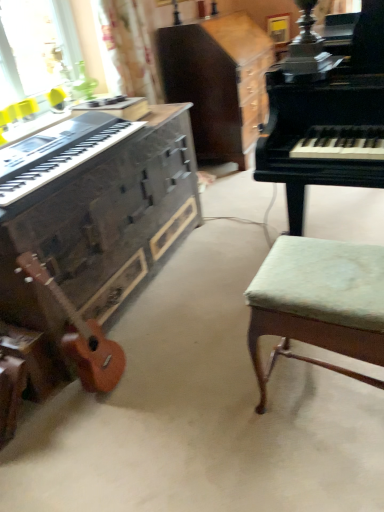
Locate an element on the screen. free space in front of green fabric stool at right is located at coordinates (322, 474).